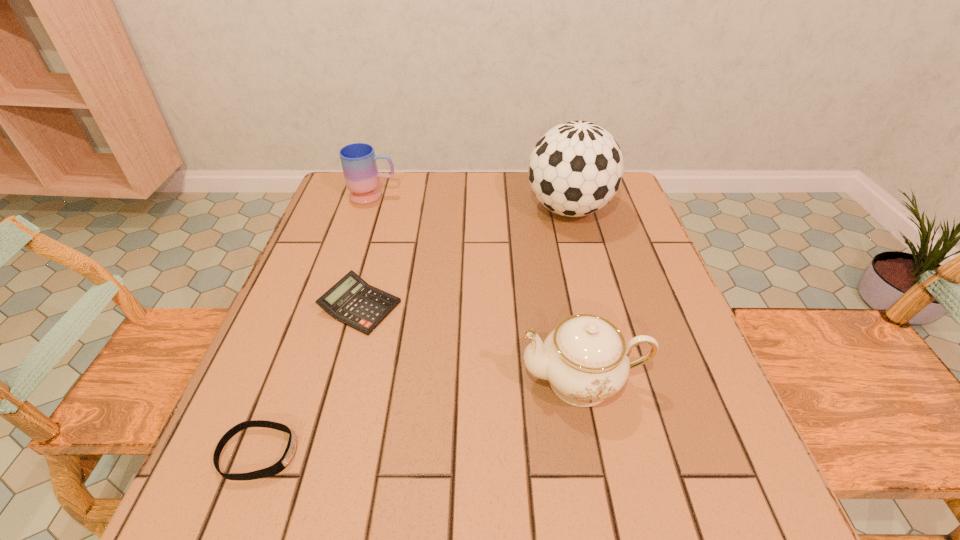
Locate an element on the screen. The image size is (960, 540). soccer ball located in the right edge section of the desktop is located at coordinates (576, 168).

Where is `chinaware positioned at the right edge`? chinaware positioned at the right edge is located at coordinates (585, 358).

Locate an element on the screen. object that is at the far left corner is located at coordinates (358, 160).

Locate an element on the screen. object at the near left corner is located at coordinates [x=289, y=452].

Locate an element on the screen. This screenshot has height=540, width=960. object present at the far right corner is located at coordinates (576, 168).

This screenshot has width=960, height=540. I want to click on free region at the far edge of the desktop, so click(x=481, y=215).

Identify the location of free space at the near edge of the desktop. Image resolution: width=960 pixels, height=540 pixels. (600, 502).

This screenshot has height=540, width=960. I want to click on free space at the left edge of the desktop, so click(320, 247).

You are a GUI agent. You are given a task and a screenshot of the screen. Output one action in this format:
    pyautogui.click(x=<x>, y=<y>)
    Task: Click on the vacant area at the right edge of the desktop
    
    Given the screenshot: What is the action you would take?
    point(632,259)

This screenshot has height=540, width=960. Find the location of `free spot between the mug and the tallest object`. free spot between the mug and the tallest object is located at coordinates (471, 202).